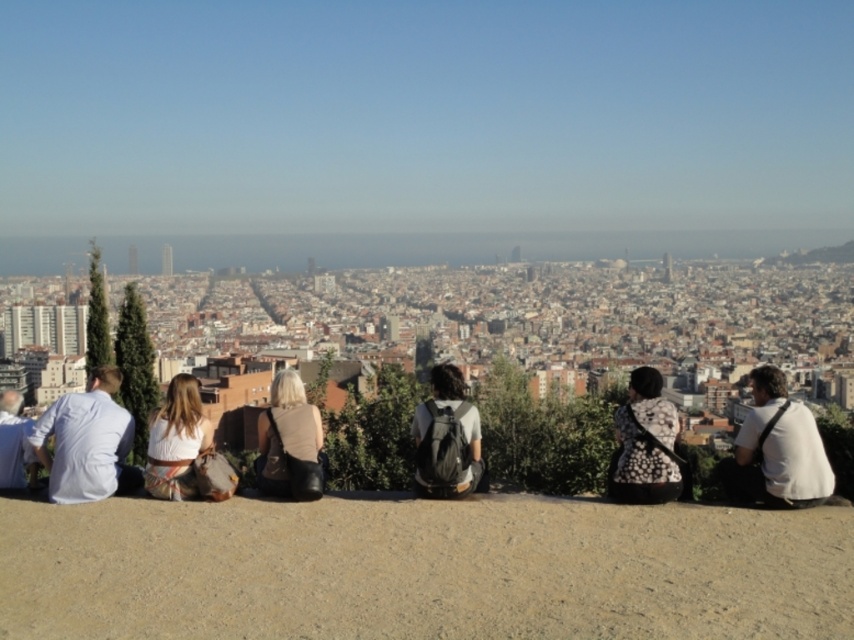
You are standing at the point marked by the coordinates point [86,442]. Looking towards the city skyline, which direction should you turn to face the white shirt at left?

The point [86,442] corresponds to the white shirt at left, so you are already facing the white shirt at left. No turn is needed.

From the picture: You are a photographer trying to capture a photo of the white shirt at left and the white fabric dress at center from the same angle. Which object should you focus on first if you want to ensure both are in focus without adjusting your camera settings?

The white shirt at left is much taller than the white fabric dress at center, so you should focus on the white shirt at left first to ensure both are in focus since it is farther away and requires a greater depth of field.